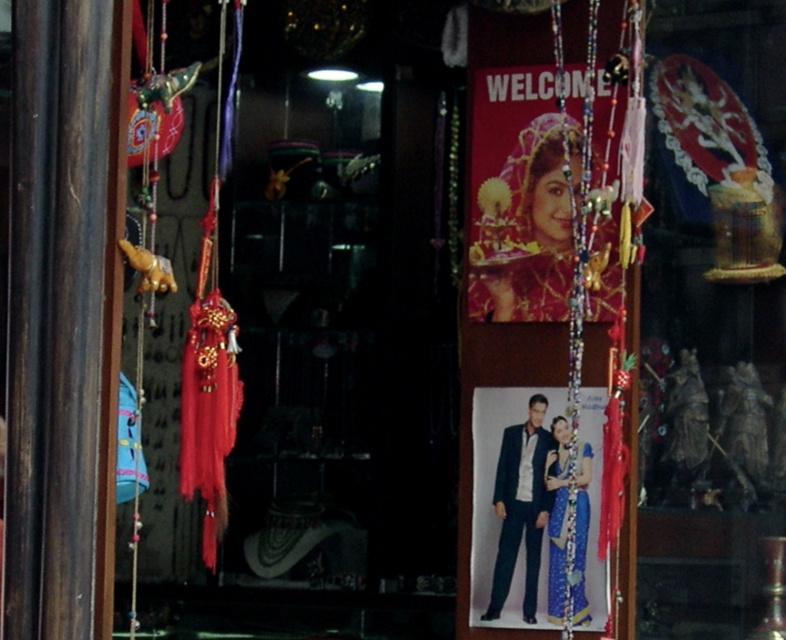
Question: Is matte gold jewelry at center positioned in front of dark blue suit at center?

Choices:
 (A) no
 (B) yes

Answer: (B)

Question: Is matte gold jewelry at center to the left of dark blue suit at center from the viewer's perspective?

Choices:
 (A) yes
 (B) no

Answer: (B)

Question: Which object is farther from the camera taking this photo?

Choices:
 (A) dark blue suit at center
 (B) blue silk saree at center

Answer: (A)

Question: Estimate the real-world distances between objects in this image. Which object is closer to the dark blue suit at center?

Choices:
 (A) matte gold jewelry at center
 (B) blue silk saree at center

Answer: (B)

Question: Is matte gold jewelry at center positioned in front of blue silk saree at center?

Choices:
 (A) yes
 (B) no

Answer: (A)

Question: Estimate the real-world distances between objects in this image. Which object is farther from the matte gold jewelry at center?

Choices:
 (A) blue silk saree at center
 (B) dark blue suit at center

Answer: (A)